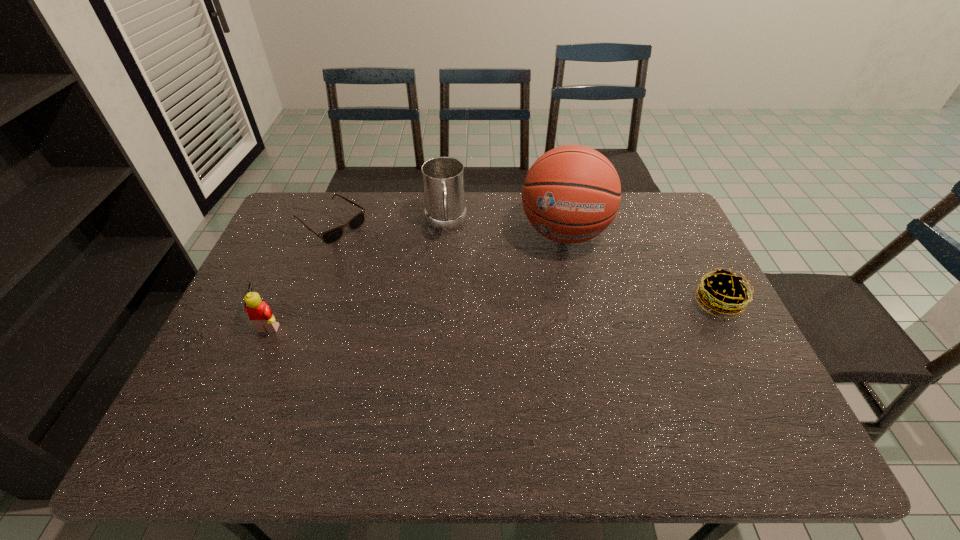
Identify the location of free space that is in between the third tallest object and the tallest object. (418, 277).

I want to click on the fourth closest object to the basketball, so click(260, 314).

The width and height of the screenshot is (960, 540). Find the location of `object that is the second closest one to the tallest object`. object that is the second closest one to the tallest object is located at coordinates (724, 293).

I want to click on vacant space that satisfies the following two spatial constraints: 1. on the front side of the mug; 2. on the left side of the rightmost object, so click(439, 303).

I want to click on vacant region that satisfies the following two spatial constraints: 1. on the back side of the fourth shortest object; 2. on the right side of the shortest object, so click(x=331, y=224).

Find the location of a particular element. vacant position in the image that satisfies the following two spatial constraints: 1. on the front side of the sunglasses; 2. on the left side of the rightmost object is located at coordinates (300, 303).